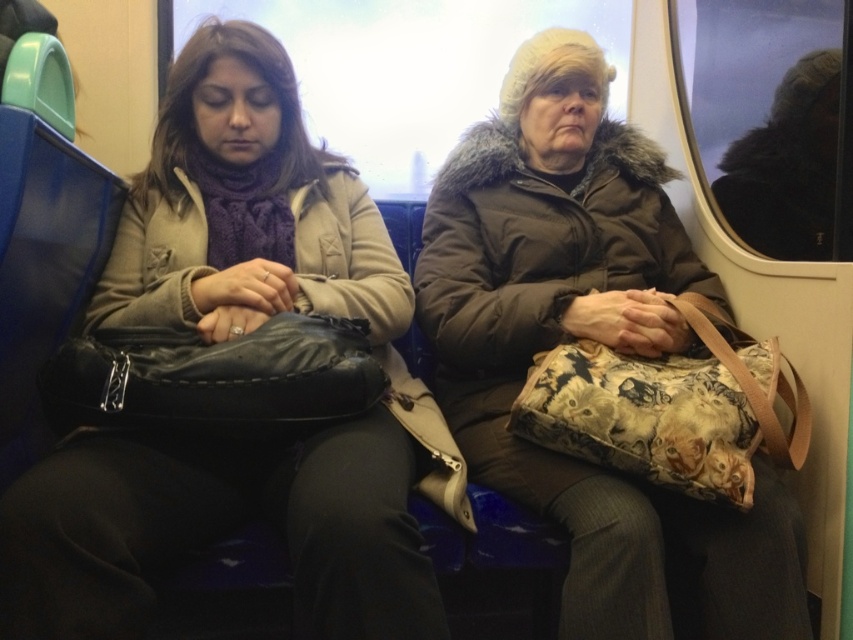
You are a passenger on a train and need to place a new bag on the seat between the matte black bag at left and the brown fuzzy coat at center. Which object should you place the new bag closer to if it needs to be lower?

You should place the new bag closer to the matte black bag at left since it has a lesser height compared to the brown fuzzy coat at center, ensuring the new bag stays lower.

You are a delivery robot on a public transport vehicle. You need to place a small package between the matte black bag at left and the brown fuzzy coat at center. Can you fit the package there if it requires 30 centimeters of space?

The matte black bag at left and brown fuzzy coat at center are 35.10 centimeters apart from each other. Since the required space is 30 centimeters, the package can be placed there as there is enough space.

You are a passenger on a train and you see two points marked on the window. The first point is at coordinate point (144, 221) and the second is at point (587, 38). Which point is closer to you?

Point (144, 221) is in front of point (587, 38), so the first point is closer to you.